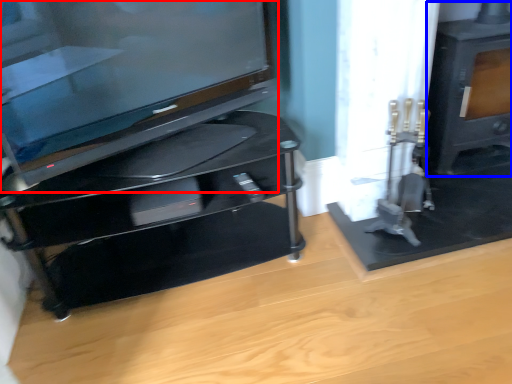
Question: Which of the following is the closest to the observer, television (highlighted by a red box) or stove (highlighted by a blue box)?

Choices:
 (A) television
 (B) stove

Answer: (A)